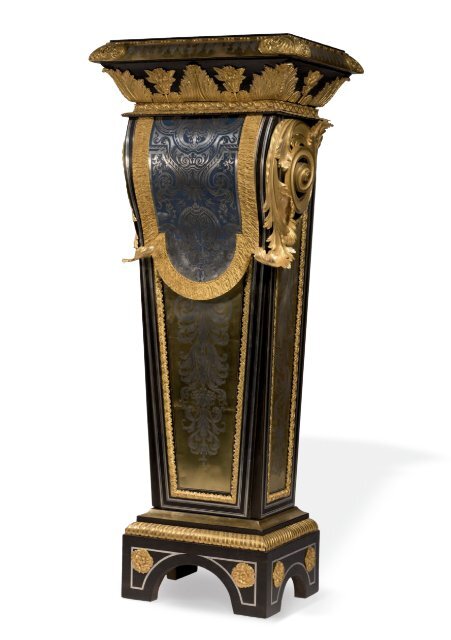
This screenshot has width=451, height=640. I want to click on pattern on top front of artwork, so click(x=198, y=148).